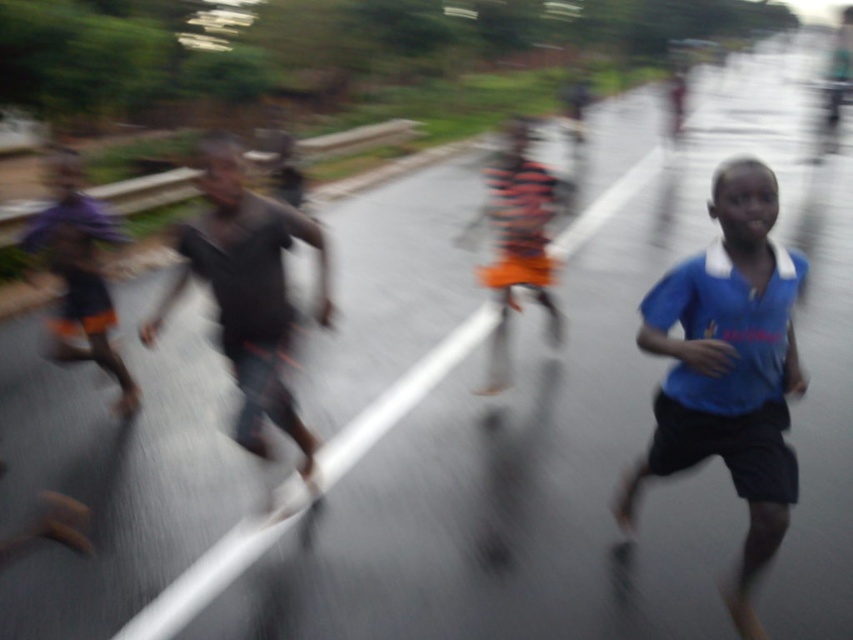
Does point (741, 474) lie behind point (520, 141)?

No, it is not.

Describe the element at coordinates (729, 369) in the screenshot. I see `blue fabric shirt at right` at that location.

Find the location of a particular element. blue fabric shirt at right is located at coordinates (729, 369).

Which is more to the left, dark gray fabric pants at left or orange striped shirt at center?

From the viewer's perspective, dark gray fabric pants at left appears more on the left side.

Which is behind, point (265, 205) or point (521, 202)?

Point (521, 202)

Locate an element on the screen. dark gray fabric pants at left is located at coordinates (248, 292).

Is point (753, 458) positioned after point (271, 268)?

No, it is not.

Is blue fabric shirt at right above dark gray fabric pants at left?

Incorrect, blue fabric shirt at right is not positioned above dark gray fabric pants at left.

Based on the photo, who is more distant from viewer, (675, 442) or (260, 412)?

Point (260, 412)

At what (x,y) coordinates should I click in order to perform the action: click on blue fabric shirt at right. Please return your answer as a coordinate pair (x, y). This screenshot has height=640, width=853. Looking at the image, I should click on (729, 369).